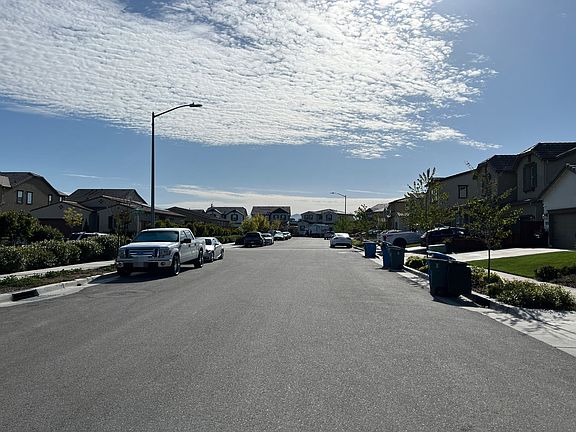
The width and height of the screenshot is (576, 432). What are the coordinates of `trash can` in the screenshot? It's located at (439, 274), (396, 261), (369, 250).